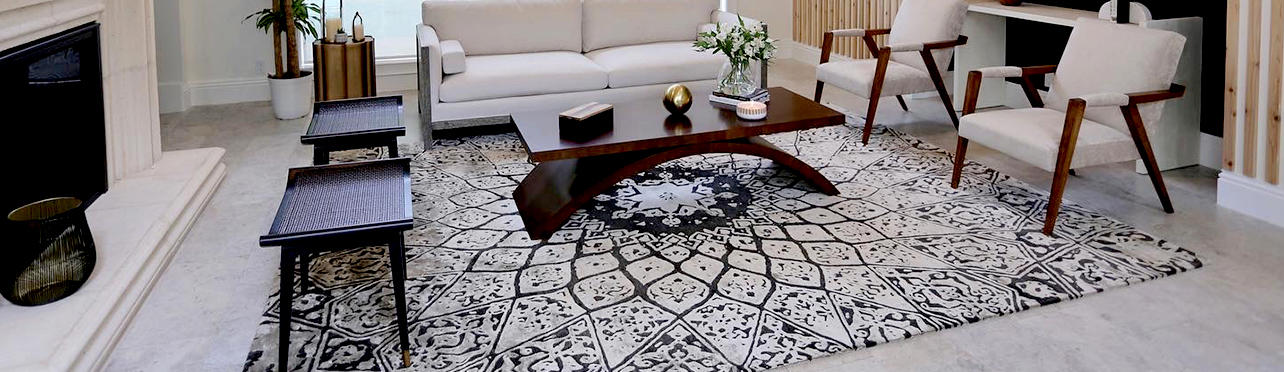
The image size is (1284, 372). Find the location of `empty floor`. empty floor is located at coordinates (1216, 328), (198, 285).